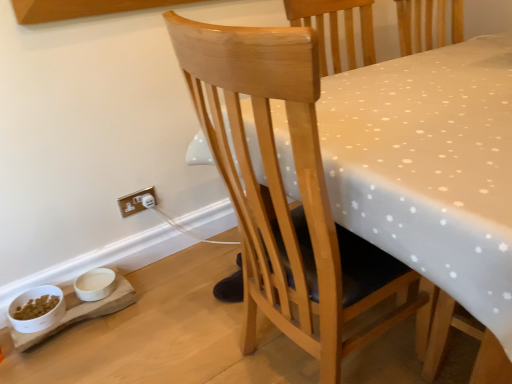
Question: Considering the relative positions of natural wood chair at center and white glossy bowl at lower left, which appears as the 1th bowl when viewed from the left, in the image provided, is natural wood chair at center to the right of white glossy bowl at lower left, which appears as the 1th bowl when viewed from the left, from the viewer's perspective?

Choices:
 (A) no
 (B) yes

Answer: (B)

Question: From a real-world perspective, is natural wood chair at center physically above white glossy bowl at lower left, the 2th bowl from the right?

Choices:
 (A) yes
 (B) no

Answer: (A)

Question: Are natural wood chair at center and white glossy bowl at lower left, which appears as the 1th bowl when viewed from the left, far apart?

Choices:
 (A) yes
 (B) no

Answer: (B)

Question: Is natural wood chair at center not within white glossy bowl at lower left, which appears as the 1th bowl when viewed from the left?

Choices:
 (A) yes
 (B) no

Answer: (A)

Question: Does natural wood chair at center turn towards white glossy bowl at lower left, which appears as the 1th bowl when viewed from the left?

Choices:
 (A) yes
 (B) no

Answer: (A)

Question: Would you say gold metallic electrical outlet at lower left is inside or outside white matte bowl at lower left, the 1th bowl viewed from the right?

Choices:
 (A) outside
 (B) inside

Answer: (A)

Question: In terms of width, does gold metallic electrical outlet at lower left look wider or thinner when compared to white matte bowl at lower left, the 1th bowl viewed from the right?

Choices:
 (A) wide
 (B) thin

Answer: (B)

Question: In terms of height, does gold metallic electrical outlet at lower left look taller or shorter compared to white matte bowl at lower left, the second bowl viewed from the left?

Choices:
 (A) short
 (B) tall

Answer: (B)

Question: Considering the relative positions of gold metallic electrical outlet at lower left and white matte bowl at lower left, the second bowl viewed from the left, in the image provided, is gold metallic electrical outlet at lower left to the left or to the right of white matte bowl at lower left, the second bowl viewed from the left,?

Choices:
 (A) right
 (B) left

Answer: (A)

Question: Is white glossy bowl at lower left, the 2th bowl from the right, situated inside natural wood chair at center or outside?

Choices:
 (A) outside
 (B) inside

Answer: (A)

Question: Looking at their shapes, would you say white glossy bowl at lower left, which appears as the 1th bowl when viewed from the left, is wider or thinner than natural wood chair at center?

Choices:
 (A) thin
 (B) wide

Answer: (A)

Question: Considering the positions of white glossy bowl at lower left, which appears as the 1th bowl when viewed from the left, and natural wood chair at center in the image, is white glossy bowl at lower left, which appears as the 1th bowl when viewed from the left, bigger or smaller than natural wood chair at center?

Choices:
 (A) big
 (B) small

Answer: (B)

Question: From the image's perspective, is white glossy bowl at lower left, which appears as the 1th bowl when viewed from the left, located above or below natural wood chair at center?

Choices:
 (A) below
 (B) above

Answer: (A)

Question: From a real-world perspective, relative to white glossy bowl at lower left, the 2th bowl from the right, is gold metallic electrical outlet at lower left vertically above or below?

Choices:
 (A) below
 (B) above

Answer: (B)

Question: Is gold metallic electrical outlet at lower left spatially inside white glossy bowl at lower left, the 2th bowl from the right, or outside of it?

Choices:
 (A) inside
 (B) outside

Answer: (B)